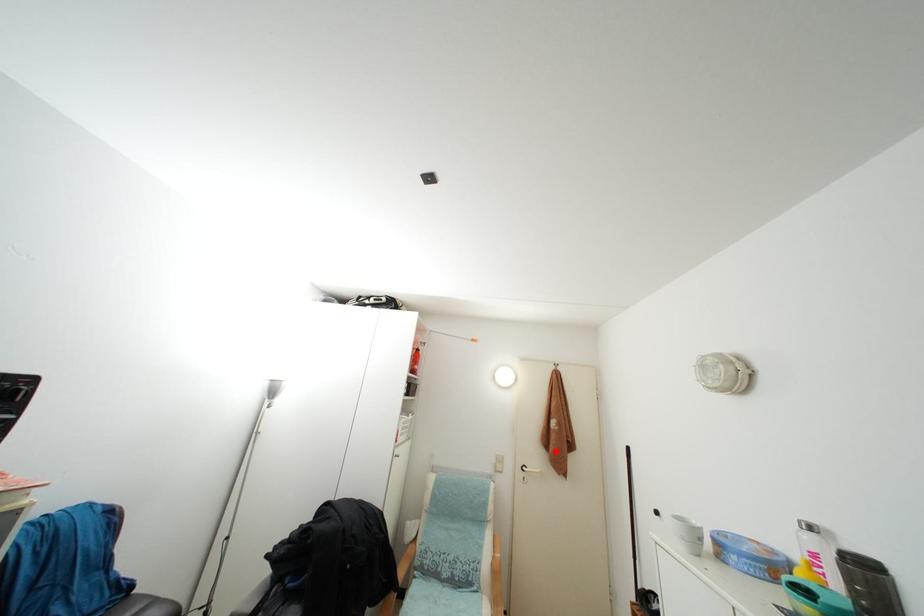
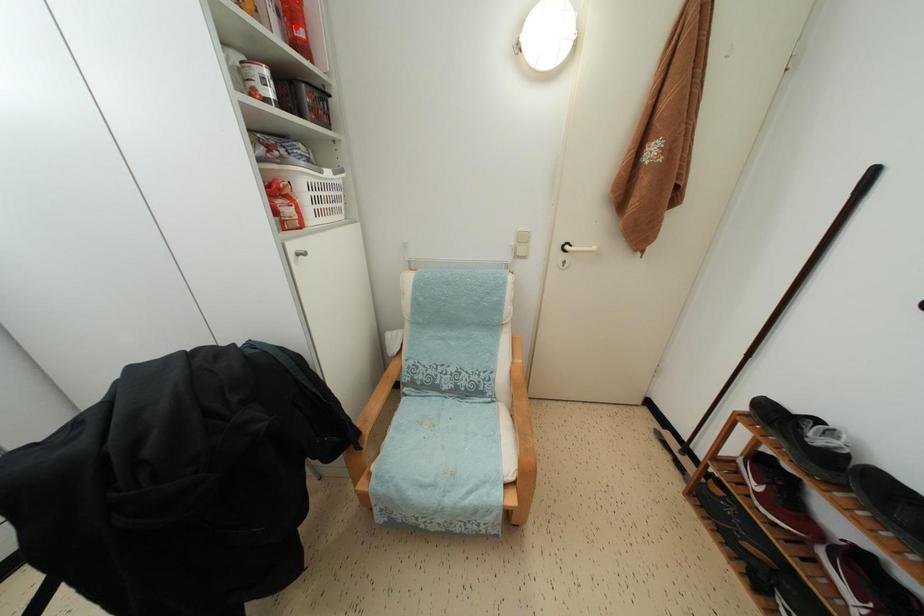
I am providing you with two images of the same scene from different viewpoints. A red point is marked on the first image and another point is marked on the second image. Do the highlighted points in image1 and image2 indicate the same real-world spot?

No